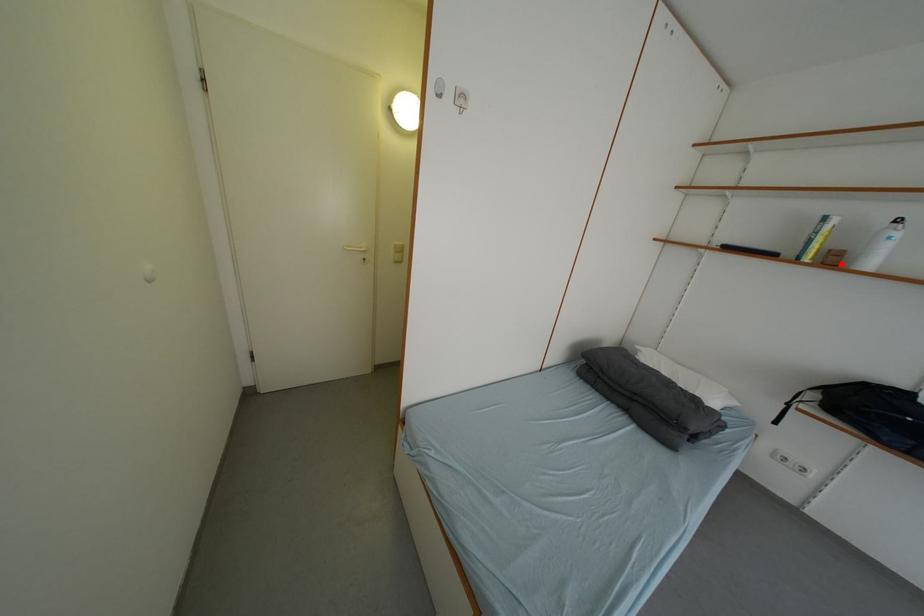
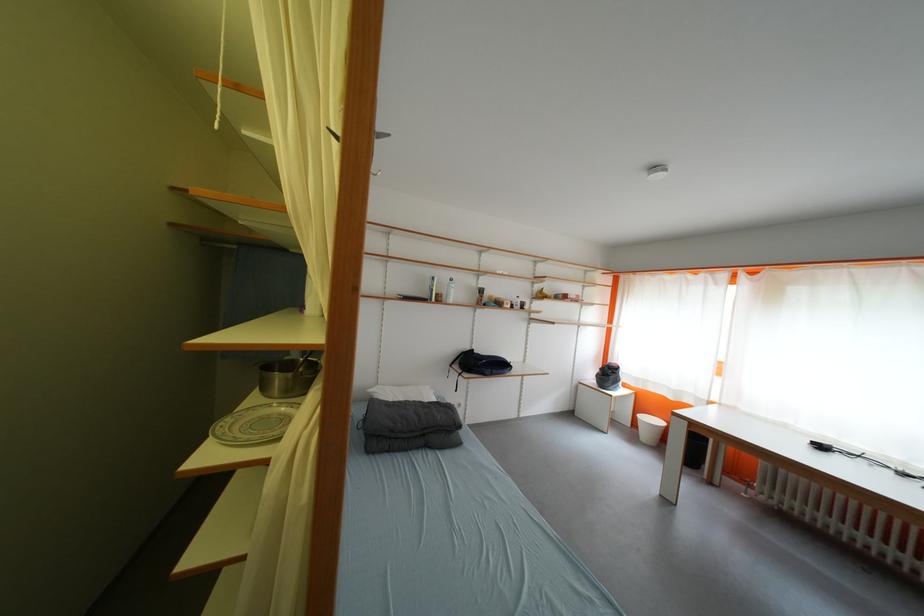
Question: A red point is marked in image1. In image2, is the corresponding 3D point closer to the camera or farther? Reply with the corresponding letter.

Choices:
 (A) The corresponding 3D point is closer.
 (B) The corresponding 3D point is farther.

Answer: (A)